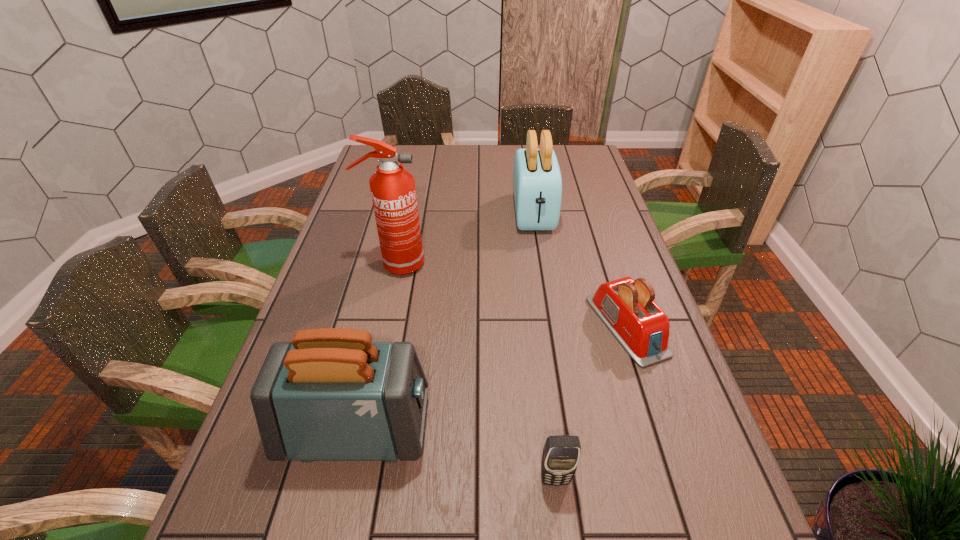
I want to click on free space located 0.140m on the side of the second toaster from right to left with the lever, so [x=541, y=266].

Locate an element on the screen. vacant area located 0.290m on the front-facing side of the second nearest object is located at coordinates (568, 429).

The image size is (960, 540). In order to click on vacant point located 0.380m on the left of the rightmost object in this screenshot , I will do `click(444, 326)`.

Locate an element on the screen. fire extinguisher positioned at the left edge is located at coordinates (393, 191).

This screenshot has width=960, height=540. I want to click on toaster that is at the left edge, so click(331, 394).

Locate an element on the screen. Image resolution: width=960 pixels, height=540 pixels. object that is at the right edge is located at coordinates (627, 308).

Image resolution: width=960 pixels, height=540 pixels. Identify the location of vacant region at the far edge. (444, 152).

The image size is (960, 540). In order to click on vacant area at the left edge of the desktop in this screenshot , I will do `click(362, 176)`.

Locate an element on the screen. This screenshot has width=960, height=540. blank space at the right edge of the desktop is located at coordinates (654, 471).

Image resolution: width=960 pixels, height=540 pixels. I want to click on vacant space at the far right corner, so pos(558,155).